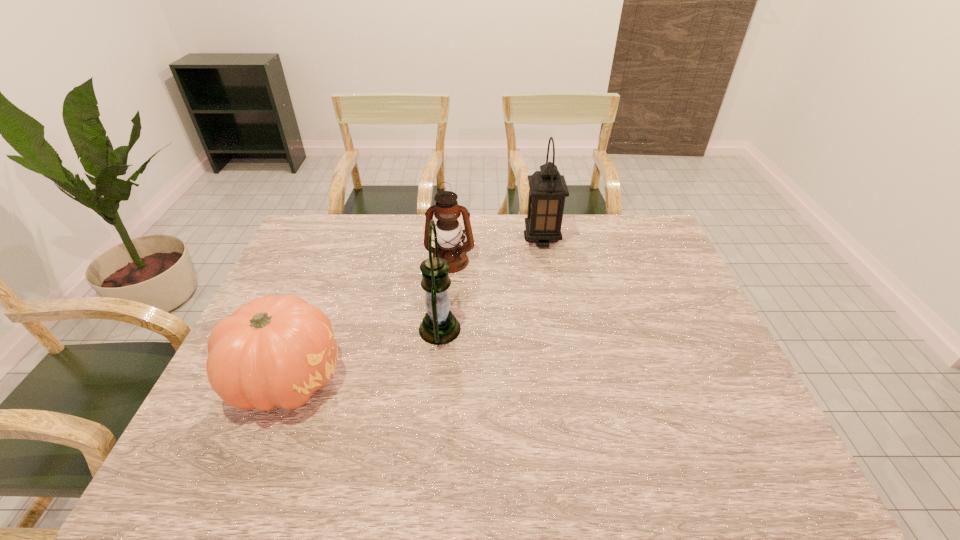
Locate an element on the screen. This screenshot has width=960, height=540. the rightmost object is located at coordinates (547, 188).

Find the location of `the nearest lantern`. the nearest lantern is located at coordinates (439, 326).

This screenshot has width=960, height=540. Identify the location of the shortest lantern. (447, 211).

Where is `the leftmost object`? the leftmost object is located at coordinates click(274, 351).

Identify the location of pumpkin. (274, 351).

Find the location of `free spot located on the right of the rightmost object`. free spot located on the right of the rightmost object is located at coordinates (618, 239).

Image resolution: width=960 pixels, height=540 pixels. Identify the location of vacant space located 0.150m on the side where the nearest lantern emits light. (516, 329).

This screenshot has width=960, height=540. What are the coordinates of `vacant space located on the side of the third tallest object, there is a wick adjustment knob` in the screenshot? It's located at (445, 320).

The height and width of the screenshot is (540, 960). Identify the location of free space located on the carved face of the shortest object. (427, 379).

I want to click on object present at the left edge, so click(274, 351).